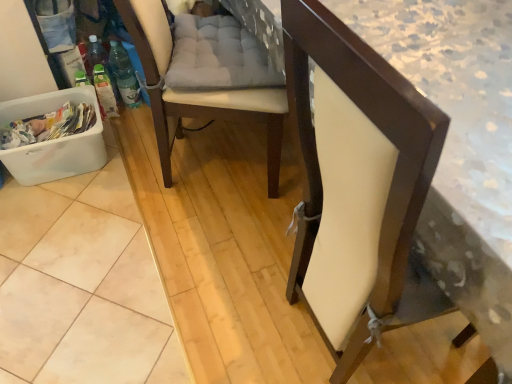
Identify the location of vacant space underneath white leather chair at center, which is the second chair from right to left (from a real-world perspective). Image resolution: width=512 pixels, height=384 pixels. pyautogui.click(x=197, y=164).